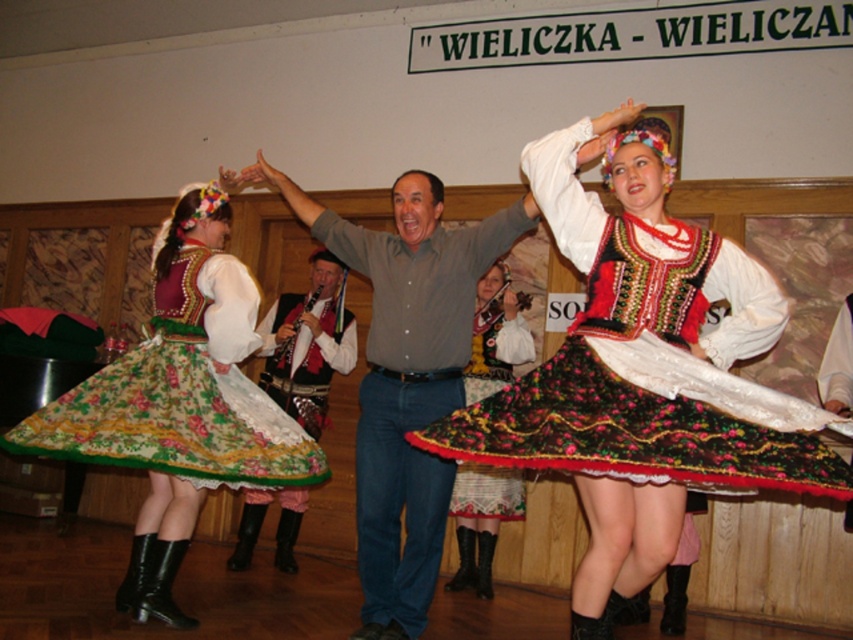
Is floral cotton skirt at center wider than floral-patterned fabric skirt at center?

In fact, floral cotton skirt at center might be narrower than floral-patterned fabric skirt at center.

Between point (627, 182) and point (172, 512), which one is positioned behind?

Point (172, 512)

At what (x,y) coordinates should I click in order to perform the action: click on floral cotton skirt at center. Please return your answer as a coordinate pair (x, y). The width and height of the screenshot is (853, 640). Looking at the image, I should click on (648, 355).

Who is shorter, floral cotton skirt at center or floral-patterned skirt at center?

With less height is floral-patterned skirt at center.

Describe the element at coordinates (648, 355) in the screenshot. I see `floral cotton skirt at center` at that location.

I want to click on floral cotton skirt at center, so 648,355.

Does floral-patterned skirt at center appear on the left side of floral fabric skirt at center?

In fact, floral-patterned skirt at center is to the right of floral fabric skirt at center.

Between floral-patterned skirt at center and floral fabric skirt at center, which one is positioned lower?

floral-patterned skirt at center

Describe the element at coordinates (480, 520) in the screenshot. The image size is (853, 640). I see `floral-patterned skirt at center` at that location.

Identify the location of floral-patterned skirt at center. Image resolution: width=853 pixels, height=640 pixels. (480, 520).